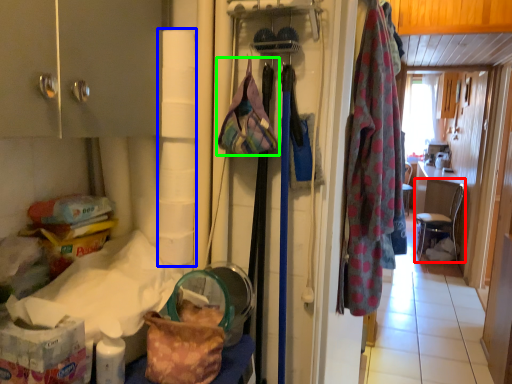
Question: Estimate the real-world distances between objects in this image. Which object is farther from chair (highlighted by a red box), toilet paper (highlighted by a blue box) or handbag (highlighted by a green box)?

Choices:
 (A) toilet paper
 (B) handbag

Answer: (A)